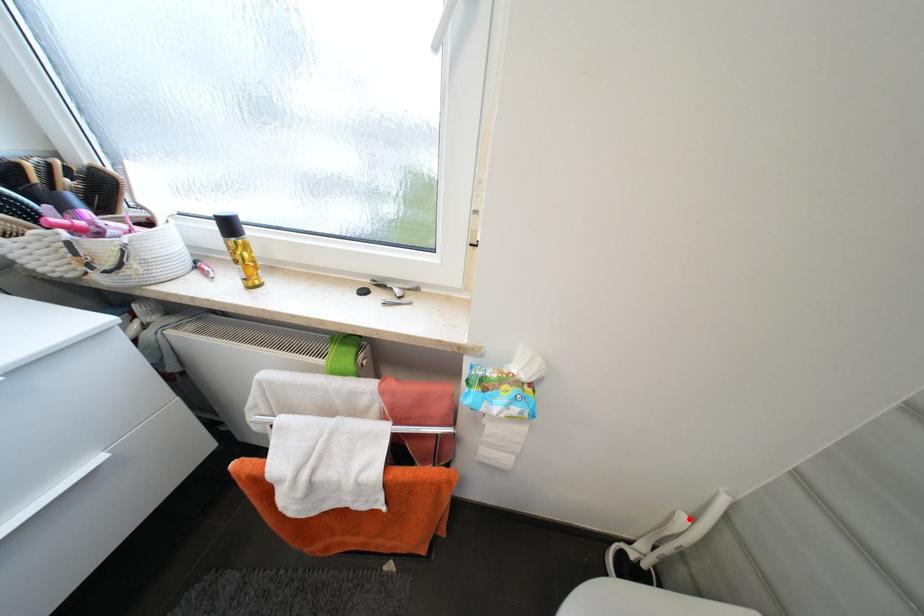
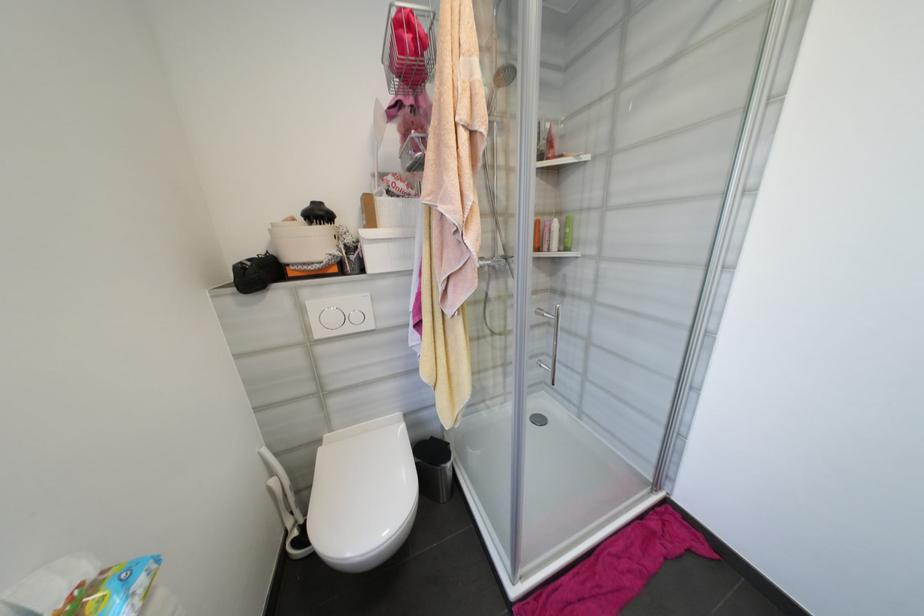
Locate, in the second image, the point that corresponds to the highlighted location in the first image.

(277, 482)